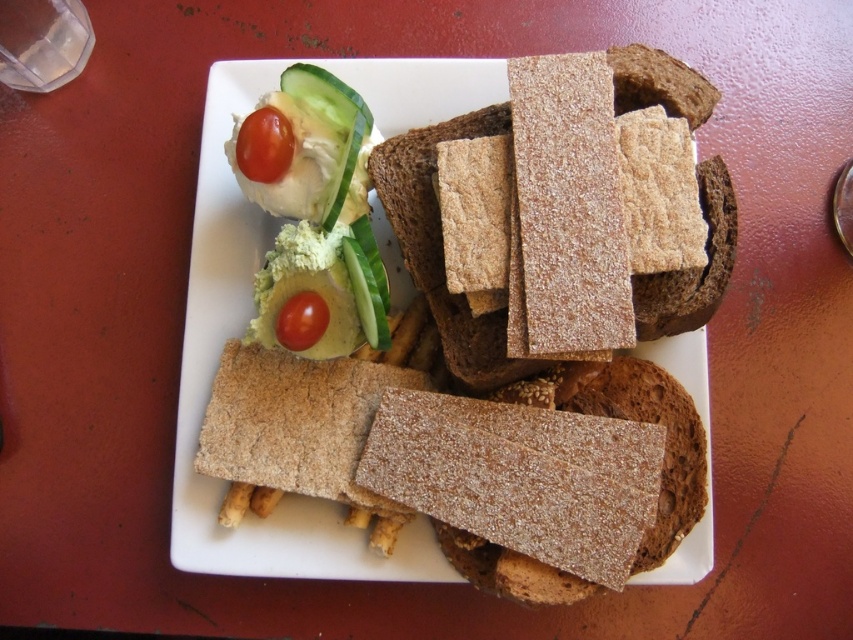
Can you confirm if brown textured bread at center is positioned above glossy red tomato at upper left?

No, brown textured bread at center is not above glossy red tomato at upper left.

Who is lower down, brown textured bread at center or glossy red tomato at upper left?

brown textured bread at center

This screenshot has width=853, height=640. What are the coordinates of `brown textured bread at center` in the screenshot? It's located at (252, 312).

Does point (276, 152) lie behind point (283, 301)?

No, (276, 152) is in front of (283, 301).

Is glossy red tomato at upper left smaller than glossy red tomato at center?

No.

The height and width of the screenshot is (640, 853). What do you see at coordinates (264, 145) in the screenshot? I see `glossy red tomato at upper left` at bounding box center [264, 145].

The width and height of the screenshot is (853, 640). I want to click on glossy red tomato at upper left, so click(x=264, y=145).

Who is higher up, brown textured bread at center or glossy red tomato at center?

brown textured bread at center is higher up.

Can you confirm if brown textured bread at center is smaller than glossy red tomato at center?

No.

Is point (190, 564) positioned behind point (282, 326)?

Yes, point (190, 564) is farther from viewer.

Where is `brown textured bread at center`? brown textured bread at center is located at coordinates (252, 312).